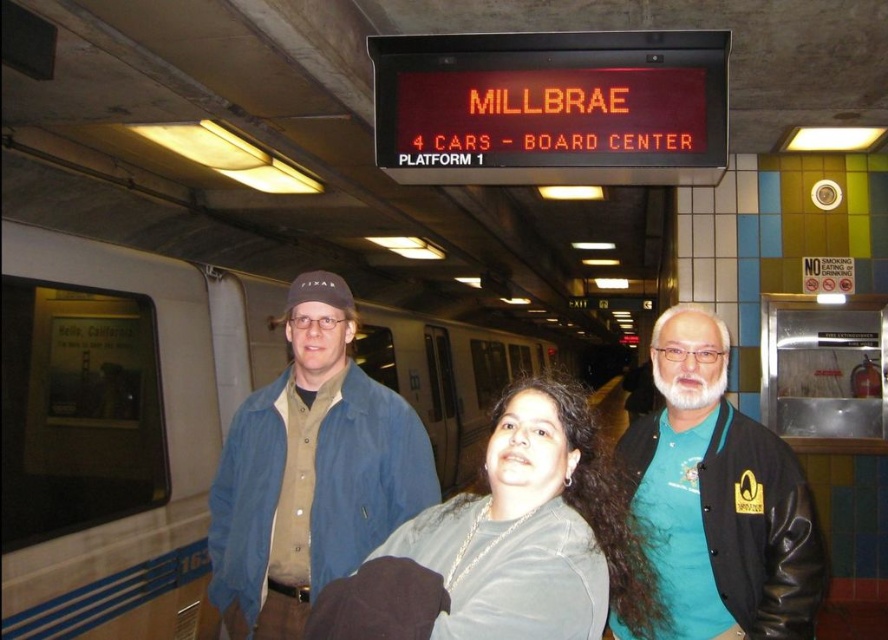
Question: Is denim jacket at center above gray matte shirt at center?

Choices:
 (A) yes
 (B) no

Answer: (B)

Question: Considering the real-world distances, which object is closest to the gray matte shirt at center?

Choices:
 (A) denim jacket at center
 (B) black leather jacket at right

Answer: (B)

Question: Which point is closer to the camera?

Choices:
 (A) (667, 534)
 (B) (492, 512)
 (C) (392, 326)
 (D) (300, 561)

Answer: (B)

Question: Which point is closer to the camera?

Choices:
 (A) (592, 442)
 (B) (643, 492)

Answer: (A)

Question: Is the position of denim jacket at center less distant than that of black leather jacket at right?

Choices:
 (A) no
 (B) yes

Answer: (A)

Question: Is silver metallic train at center smaller than black leather jacket at right?

Choices:
 (A) yes
 (B) no

Answer: (B)